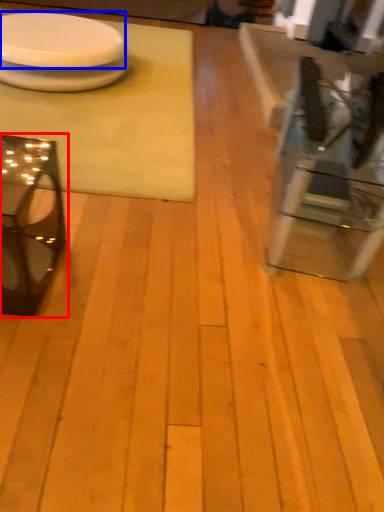
Question: Which object appears closest to the camera in this image, table (highlighted by a red box) or platter (highlighted by a blue box)?

Choices:
 (A) table
 (B) platter

Answer: (A)